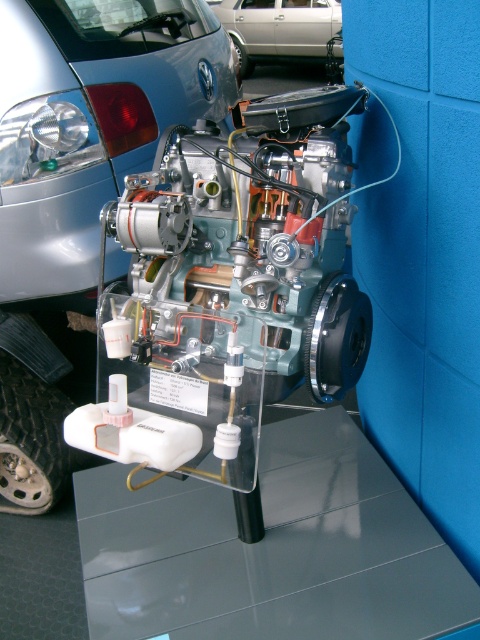
You are an engineer inspecting the engine display. You need to determine if the satin silver engine at center can fit into the space originally designed for the silver metallic car at upper center. Based on their dimensions, what do you conclude?

The satin silver engine at center is thinner than the silver metallic car at upper center, so it can fit into the space designed for the car.

You are a museum visitor standing in front of the engine display. You notice the satin silver engine at center and the silver metallic car at upper center. Which object is closer to you?

The satin silver engine at center is closer to you because it is positioned in front of the silver metallic car at upper center.

You are an engineer standing in front of the car engine exhibit. You need to locate the satin silver engine at center. What are its coordinates?

The satin silver engine at center is located at coordinates 0.300 on the x axis and 0.165 on the y axis.